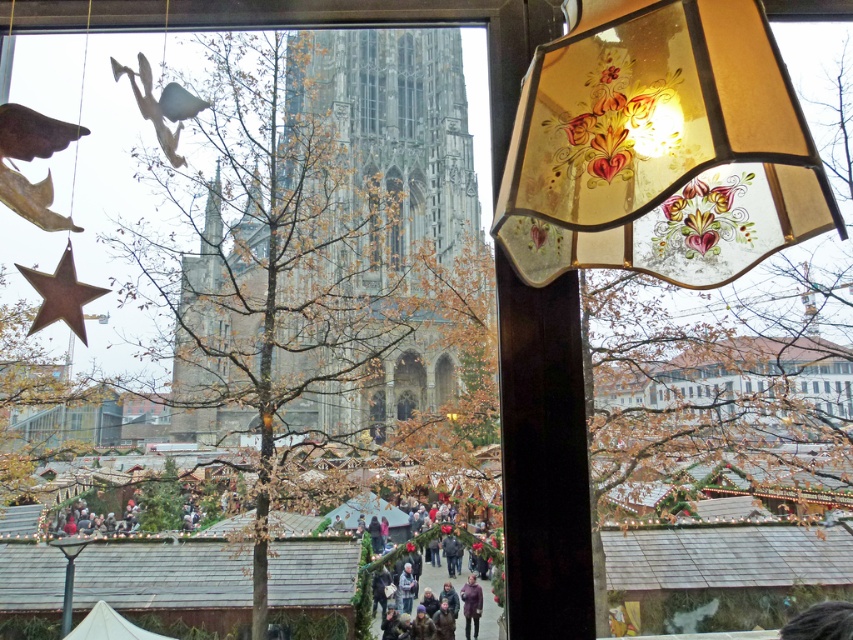
Question: Does translucent stained glass lampshade at upper right lie in front of matte green fabric canopy at center?

Choices:
 (A) yes
 (B) no

Answer: (A)

Question: From the image, what is the correct spatial relationship of translucent stained glass lampshade at upper right in relation to purple matte jacket at center?

Choices:
 (A) below
 (B) above

Answer: (B)

Question: Estimate the real-world distances between objects in this image. Which object is farther from the translucent stained glass lampshade at upper right?

Choices:
 (A) matte green fabric canopy at center
 (B) white fabric canopy at lower left

Answer: (B)

Question: Can you confirm if white fabric canopy at lower left is positioned to the left of purple matte jacket at center?

Choices:
 (A) yes
 (B) no

Answer: (A)

Question: Which object is closer to the camera taking this photo?

Choices:
 (A) translucent stained glass lampshade at upper right
 (B) matte green fabric canopy at center
 (C) purple matte jacket at center

Answer: (A)

Question: Which object appears closest to the camera in this image?

Choices:
 (A) purple matte jacket at center
 (B) translucent stained glass lampshade at upper right
 (C) white fabric canopy at lower left
 (D) matte green fabric canopy at center

Answer: (B)